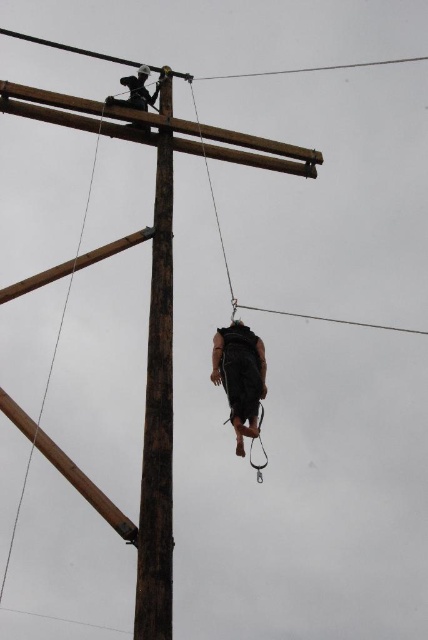
Who is positioned more to the left, smooth wooden telegraph pole at center or clear wire at upper center?

smooth wooden telegraph pole at center

Is smooth wooden telegraph pole at center to the left of clear wire at upper center from the viewer's perspective?

Indeed, smooth wooden telegraph pole at center is positioned on the left side of clear wire at upper center.

The width and height of the screenshot is (428, 640). What do you see at coordinates (157, 420) in the screenshot?
I see `smooth wooden telegraph pole at center` at bounding box center [157, 420].

At what (x,y) coordinates should I click in order to perform the action: click on smooth wooden telegraph pole at center. Please return your answer as a coordinate pair (x, y). The width and height of the screenshot is (428, 640). Looking at the image, I should click on (157, 420).

Which of these two, smooth wire at upper center or black wire at center, stands shorter?

With less height is black wire at center.

Which is behind, point (32, 42) or point (333, 321)?

The point (32, 42) is behind.

Where is `smooth wire at upper center`? This screenshot has width=428, height=640. smooth wire at upper center is located at coordinates (305, 68).

Who is shorter, dark brown leather helmet at upper center or clear wire at upper center?

clear wire at upper center is shorter.

Which is more to the left, dark brown leather helmet at upper center or clear wire at upper center?

dark brown leather helmet at upper center is more to the left.

Does point (127, 77) come behind point (338, 65)?

No, (127, 77) is closer to viewer.

Where is `dark brown leather helmet at upper center`? The width and height of the screenshot is (428, 640). dark brown leather helmet at upper center is located at coordinates (136, 92).